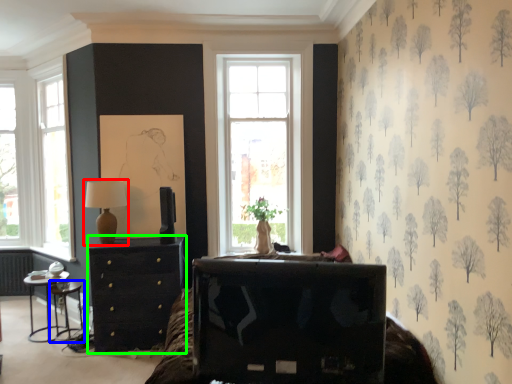
Question: Based on their relative distances, which object is nearer to table lamp (highlighted by a red box)? Choose from side table (highlighted by a blue box) and chest of drawers (highlighted by a green box).

Choices:
 (A) side table
 (B) chest of drawers

Answer: (B)